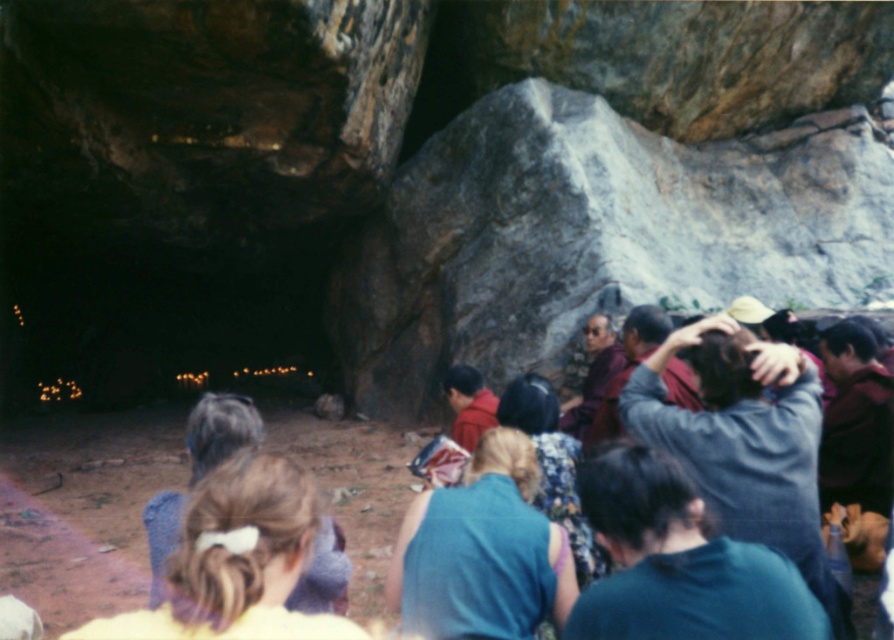
Can you confirm if blonde hair at center is positioned above purple velvet robe at center?

Actually, blonde hair at center is below purple velvet robe at center.

Who is positioned more to the right, blonde hair at center or purple velvet robe at center?

Positioned to the right is purple velvet robe at center.

At what (x,y) coordinates should I click in order to perform the action: click on blonde hair at center. Please return your answer as a coordinate pair (x, y). The width and height of the screenshot is (894, 640). Looking at the image, I should click on (199, 468).

Locate an element on the screen. This screenshot has height=640, width=894. blonde hair at center is located at coordinates (199, 468).

Is blonde hair bun at center positioned before blonde hair at center?

Yes.

Can you confirm if blonde hair bun at center is smaller than blonde hair at center?

Correct, blonde hair bun at center occupies less space than blonde hair at center.

Who is more forward, (x=260, y=458) or (x=191, y=474)?

Positioned in front is point (x=260, y=458).

The height and width of the screenshot is (640, 894). Identify the location of blonde hair bun at center. (235, 563).

The width and height of the screenshot is (894, 640). Describe the element at coordinates (593, 237) in the screenshot. I see `gray rough rock at center` at that location.

Between gray rough rock at center and maroon velvet robe at right, which one has more height?

gray rough rock at center

Find the location of a particular element. gray rough rock at center is located at coordinates (593, 237).

Identify the location of gray rough rock at center. The image size is (894, 640). (593, 237).